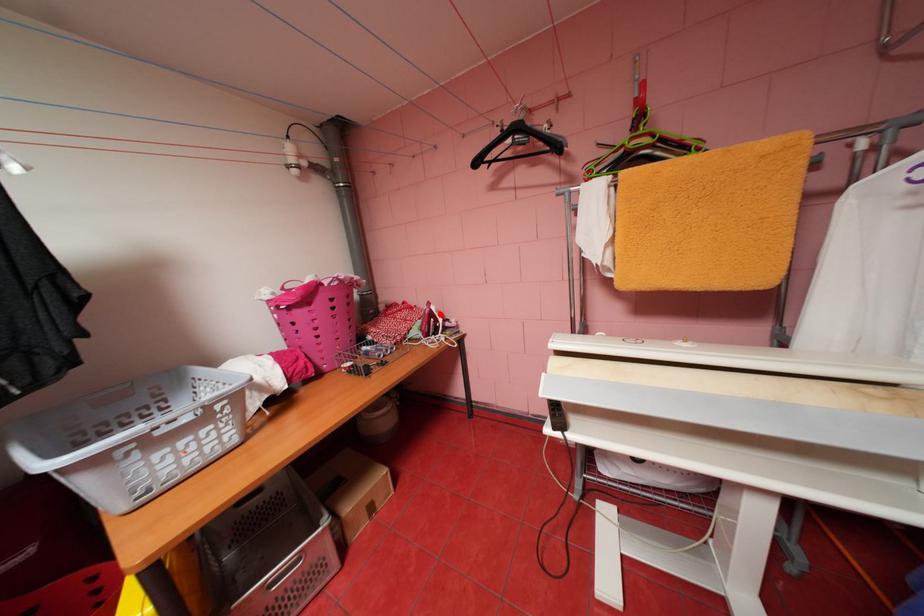
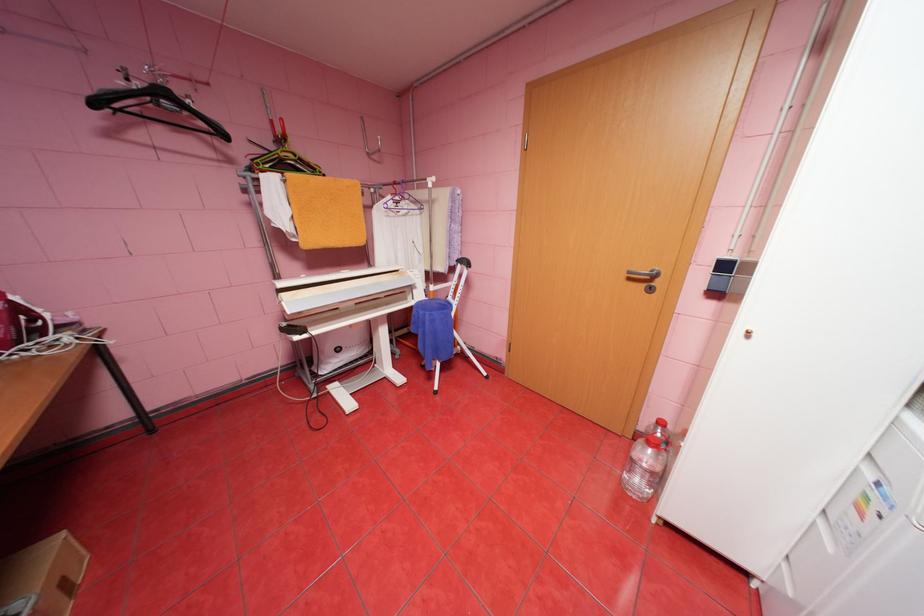
Find the pixel in the second image that matches the highlighted location in the first image.

(26, 309)